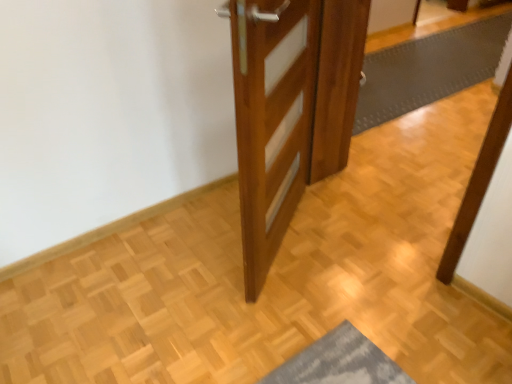
Find the location of `vacant space situated on the left part of wooden door at center`. vacant space situated on the left part of wooden door at center is located at coordinates (178, 255).